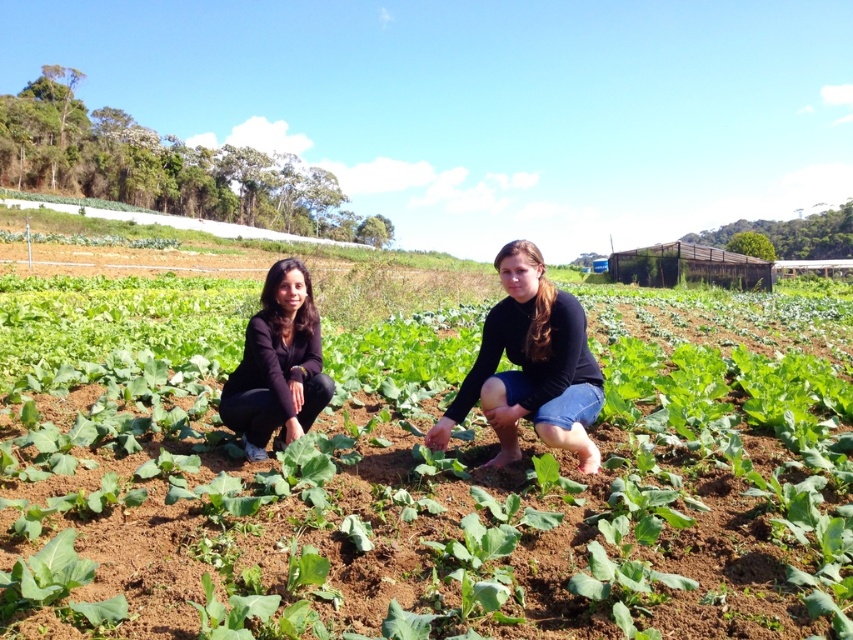
You are a farmer checking the crops in the field. You notice the green leafy plant at center and the black matte jacket at center. Which object is positioned more to the left?

The green leafy plant at center is positioned to the left of the black matte jacket at center.

You are a farmer checking the growth of your crops. You notice the green leafy plant at center in your field. Where exactly is this plant located in your field?

The green leafy plant at center is located at point (x=426, y=488) in the field.